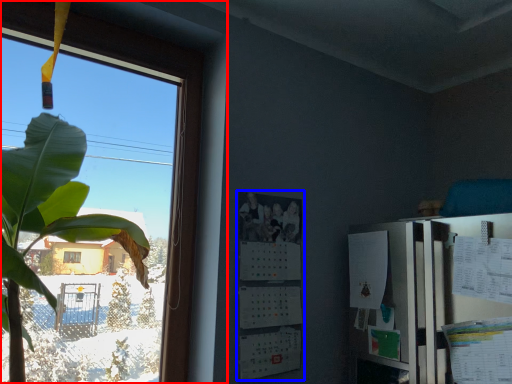
Question: Among these objects, which one is farthest to the camera, window (highlighted by a red box) or bulletin board (highlighted by a blue box)?

Choices:
 (A) window
 (B) bulletin board

Answer: (B)